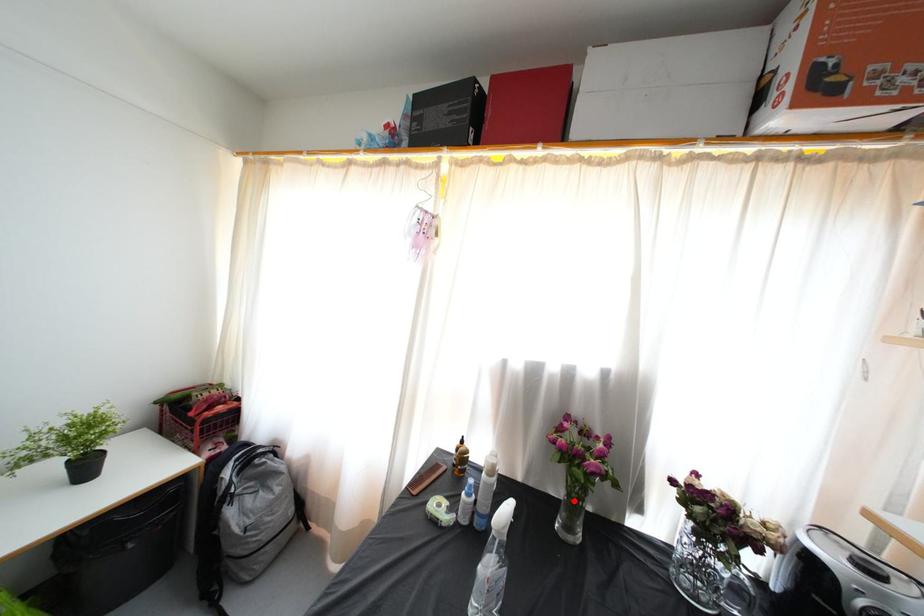
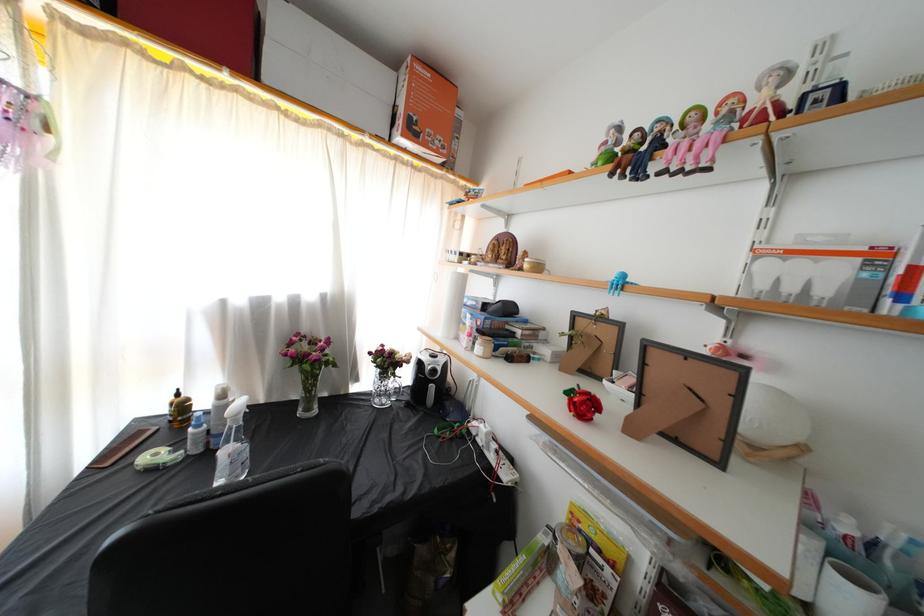
The point at the highlighted location is marked in the first image. Where is the corresponding point in the second image?

(310, 392)